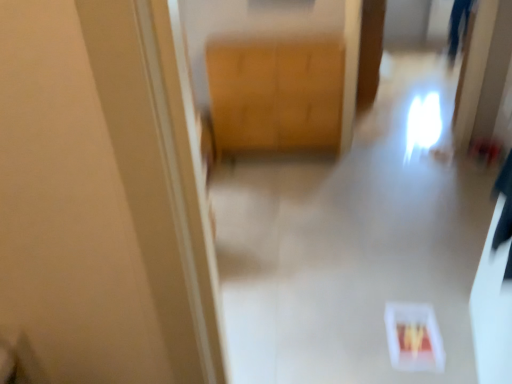
Question: Is white plastic container at lower center to the left of wooden cabinet at center from the viewer's perspective?

Choices:
 (A) no
 (B) yes

Answer: (A)

Question: Can wooden cabinet at center be found inside white plastic container at lower center?

Choices:
 (A) yes
 (B) no

Answer: (B)

Question: Is white plastic container at lower center positioned with its back to wooden cabinet at center?

Choices:
 (A) no
 (B) yes

Answer: (A)

Question: Would you say white plastic container at lower center is outside wooden cabinet at center?

Choices:
 (A) yes
 (B) no

Answer: (A)

Question: Considering the relative sizes of white plastic container at lower center and wooden cabinet at center in the image provided, is white plastic container at lower center bigger than wooden cabinet at center?

Choices:
 (A) yes
 (B) no

Answer: (A)

Question: Is white plastic container at lower center further to the viewer compared to wooden cabinet at center?

Choices:
 (A) no
 (B) yes

Answer: (A)

Question: Can we say wooden cabinet at center lies outside white plastic container at lower center?

Choices:
 (A) no
 (B) yes

Answer: (B)

Question: Is wooden cabinet at center thinner than white plastic container at lower center?

Choices:
 (A) no
 (B) yes

Answer: (B)

Question: From the image's perspective, is wooden cabinet at center above white plastic container at lower center?

Choices:
 (A) no
 (B) yes

Answer: (B)

Question: Is wooden cabinet at center further to the viewer compared to white plastic container at lower center?

Choices:
 (A) yes
 (B) no

Answer: (A)

Question: Does wooden cabinet at center come in front of white plastic container at lower center?

Choices:
 (A) no
 (B) yes

Answer: (A)

Question: Considering the relative sizes of wooden cabinet at center and white plastic container at lower center in the image provided, is wooden cabinet at center bigger than white plastic container at lower center?

Choices:
 (A) no
 (B) yes

Answer: (A)

Question: Considering their positions, is white plastic container at lower center located in front of or behind wooden cabinet at center?

Choices:
 (A) behind
 (B) front

Answer: (B)